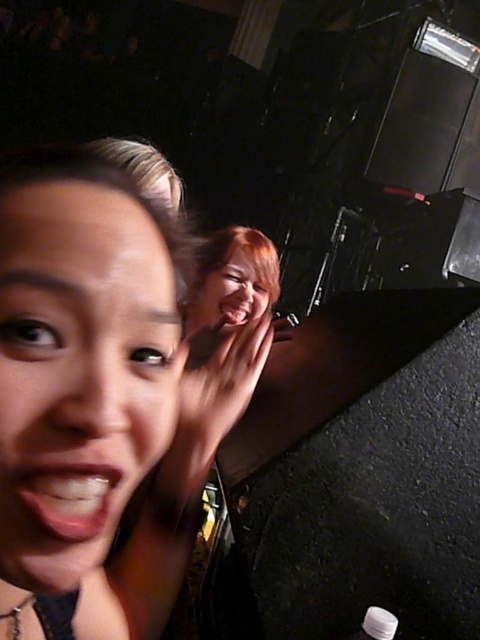
You are a photographer trying to capture a group photo of the matte skin face at left and the smooth skin face at upper center. Which face is located to the left of the other?

The matte skin face at left is positioned on the left side of smooth skin face at upper center.

You are a photographer who wants to capture a closeup of the smooth skin face at upper center without the white matte bottle at lower right appearing in the background. Is it possible to adjust your camera angle to achieve this?

The smooth skin face at upper center is above the white matte bottle at lower right, so by tilting the camera upward to focus on the face while keeping the bottle below the frame, it can be excluded from the shot.

Consider the image. You are a photographer trying to capture a closeup shot of the matte skin face at left and the white matte bottle at lower right. Which object is positioned higher in the frame?

The matte skin face at left is taller than the white matte bottle at lower right, so the matte skin face at left is positioned higher in the frame.